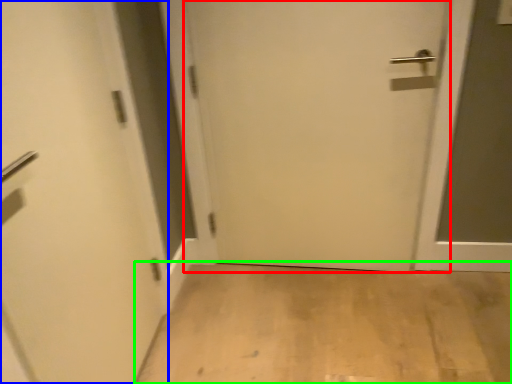
Question: Which object is the farthest from door (highlighted by a red box)? Choose among these: door (highlighted by a blue box) or corridor (highlighted by a green box).

Choices:
 (A) door
 (B) corridor

Answer: (A)